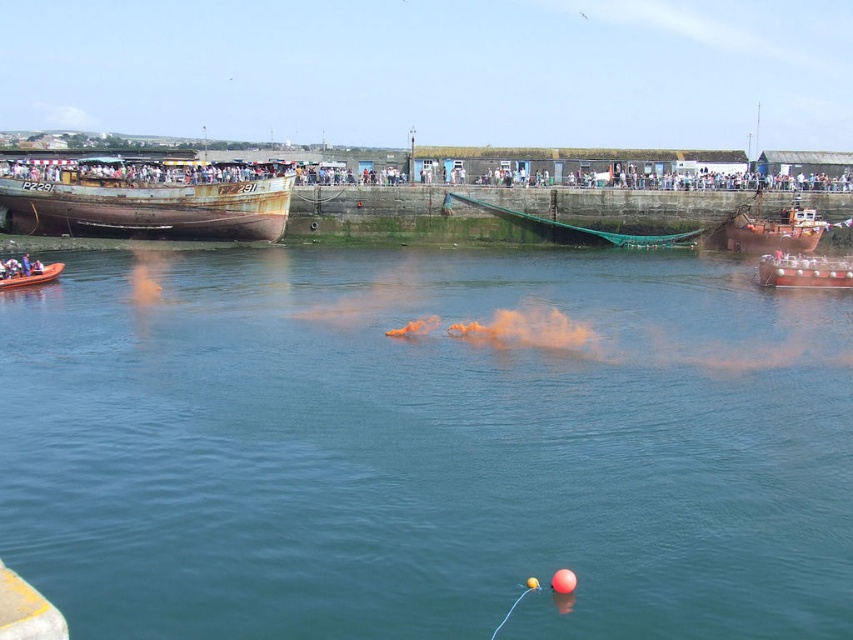
Between rusty metal boat at right and brushed metal boat at lower left, which one is positioned higher?

rusty metal boat at right

Consider the image. Measure the distance from rusty metal boat at right to brushed metal boat at lower left.

58.58 meters

Is point (756, 220) positioned in front of point (6, 280)?

No, (756, 220) is further to viewer.

Find the location of a particular element. The width and height of the screenshot is (853, 640). rusty metal boat at right is located at coordinates (775, 230).

Can you confirm if orange smoke at center is bigger than matte black boat at upper center?

Indeed, orange smoke at center has a larger size compared to matte black boat at upper center.

In the scene shown: Measure the distance between orange smoke at center and matte black boat at upper center.

A distance of 137.26 feet exists between orange smoke at center and matte black boat at upper center.

Describe the element at coordinates (426, 449) in the screenshot. This screenshot has width=853, height=640. I see `orange smoke at center` at that location.

Where is `orange smoke at center`? orange smoke at center is located at coordinates (426, 449).

Can you confirm if matte black boat at upper center is thinner than rusty metal boat at right?

In fact, matte black boat at upper center might be wider than rusty metal boat at right.

Is point (210, 172) positioned after point (759, 232)?

Yes, it is behind point (759, 232).

Where is `matte black boat at upper center`? This screenshot has width=853, height=640. matte black boat at upper center is located at coordinates (178, 172).